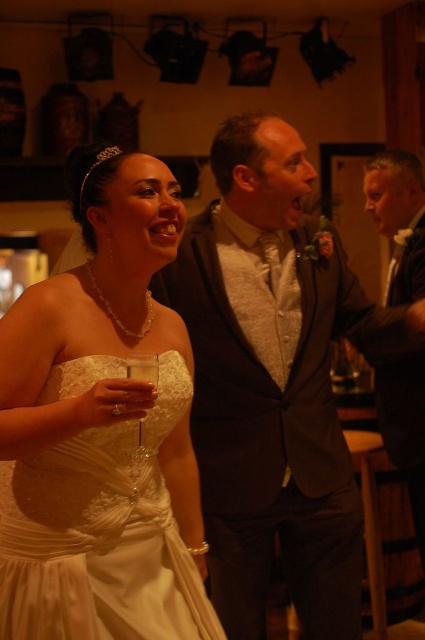
Question: Does white satin dress at left have a lesser width compared to shiny silver vest at center?

Choices:
 (A) yes
 (B) no

Answer: (A)

Question: Which point appears farthest from the camera in this image?

Choices:
 (A) (334, 284)
 (B) (90, 618)
 (C) (144, 378)

Answer: (A)

Question: Can you confirm if white satin dress at left is positioned to the right of clear glass wine glass at lower left?

Choices:
 (A) yes
 (B) no

Answer: (B)

Question: Does shiny silver vest at center appear on the right side of clear glass wine glass at lower left?

Choices:
 (A) yes
 (B) no

Answer: (A)

Question: Which of the following is the farthest from the observer?

Choices:
 (A) (207, 308)
 (B) (147, 452)

Answer: (A)

Question: Among these objects, which one is farthest from the camera?

Choices:
 (A) white satin dress at left
 (B) clear glass wine glass at lower left

Answer: (A)